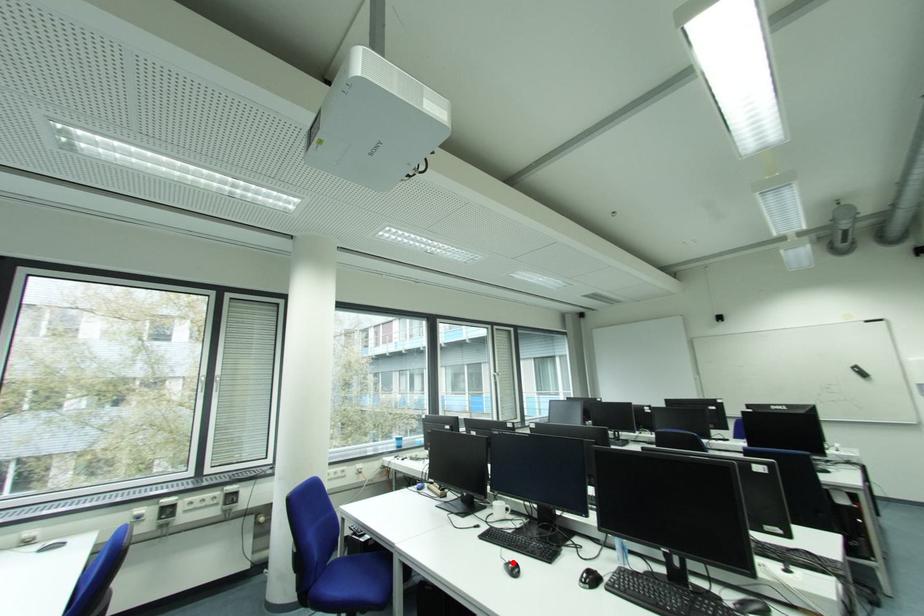
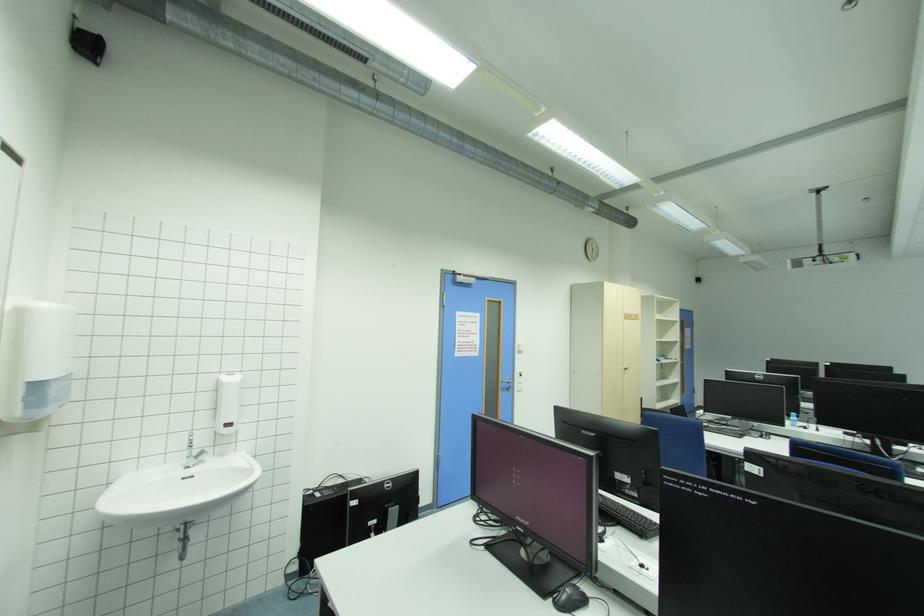
Question: I am providing you with two images of the same scene from different viewpoints. A red point is marked on the first image. Is the red point's position out of view in image 2?

Choices:
 (A) Yes
 (B) No

Answer: (A)